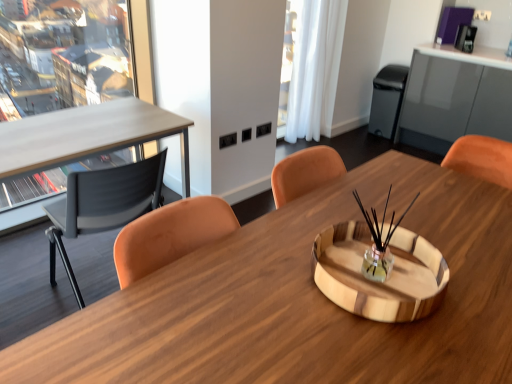
You are a GUI agent. You are given a task and a screenshot of the screen. Output one action in this format:
    pyautogui.click(x=<x>, y=<y>)
    Task: Click on the white sheer curtain at upper right
    The height and width of the screenshot is (384, 512).
    Given the screenshot: What is the action you would take?
    [x=315, y=69]

Image resolution: width=512 pixels, height=384 pixels. Describe the element at coordinates (387, 100) in the screenshot. I see `black matte trash bin/can at right` at that location.

In order to click on white sheer curtain at upper right in this screenshot , I will do pyautogui.click(x=315, y=69).

Is wooden desk at center placed right next to white sheer curtain at upper right?

No, wooden desk at center is not next to white sheer curtain at upper right.

Between wooden desk at center and white sheer curtain at upper right, which one has larger size?

Bigger between the two is wooden desk at center.

From the image's perspective, does wooden desk at center appear lower than white sheer curtain at upper right?

Yes, from the image's perspective, wooden desk at center is beneath white sheer curtain at upper right.

Is point (146, 282) in front of point (320, 122)?

That is True.

Can you confirm if wooden desk at center is thinner than black matte trash bin/can at right?

No.

Find the location of a particular element. The height and width of the screenshot is (384, 512). desk that is below the black matte trash bin/can at right (from the image's perspective) is located at coordinates tap(300, 300).

From the image's perspective, between wooden desk at center and black matte trash bin/can at right, who is located below?

wooden desk at center, from the image's perspective.

Considering the relative positions of matte black chair at left and black matte trash bin/can at right in the image provided, is matte black chair at left in front of black matte trash bin/can at right?

Yes, it is.

Which object is positioned more to the left, matte black chair at left or black matte trash bin/can at right?

matte black chair at left.

Where is `trash bin/can below the matte black chair at left (from a real-world perspective)`? trash bin/can below the matte black chair at left (from a real-world perspective) is located at coordinates (387, 100).

From a real-world perspective, which is physically below, white sheer curtain at upper right or matte black chair at left?

In real-world perspective, matte black chair at left is lower.

Looking at the image, does white sheer curtain at upper right seem bigger or smaller compared to matte black chair at left?

Considering their sizes, white sheer curtain at upper right takes up less space than matte black chair at left.

Which of these two, white sheer curtain at upper right or matte black chair at left, is wider?

matte black chair at left is wider.

Which of these two, white sheer curtain at upper right or matte black chair at left, stands shorter?

Standing shorter between the two is matte black chair at left.

Who is shorter, black matte trash bin/can at right or matte black chair at left?

With less height is black matte trash bin/can at right.

Looking at their sizes, would you say black matte trash bin/can at right is wider or thinner than matte black chair at left?

black matte trash bin/can at right is thinner than matte black chair at left.

Can you confirm if black matte trash bin/can at right is positioned to the left of matte black chair at left?

In fact, black matte trash bin/can at right is to the right of matte black chair at left.

Would you say black matte trash bin/can at right is to the left or to the right of wooden desk at center in the picture?

In the image, black matte trash bin/can at right appears on the right side of wooden desk at center.

From the image's perspective, which is below, black matte trash bin/can at right or wooden desk at center?

wooden desk at center appears lower in the image.

Is black matte trash bin/can at right facing towards wooden desk at center?

No.

Which is in front, point (386, 74) or point (404, 161)?

The point (404, 161) is closer.

Which object is further away from the camera, matte black chair at left or wooden desk at center?

matte black chair at left is more distant.

Is wooden desk at center at the back of matte black chair at left?

That's right, matte black chair at left is facing away from wooden desk at center.

How different are the orientations of matte black chair at left and wooden desk at center in degrees?

The angular difference between matte black chair at left and wooden desk at center is 166 degrees.

From a real-world perspective, is matte black chair at left over wooden desk at center?

Yes, from a real-world perspective, matte black chair at left is on top of wooden desk at center.

Image resolution: width=512 pixels, height=384 pixels. There is a wooden desk at center. Find the location of `curtain above it (from a real-world perspective)`. curtain above it (from a real-world perspective) is located at coordinates (315, 69).

The height and width of the screenshot is (384, 512). I want to click on desk on the left of black matte trash bin/can at right, so click(300, 300).

Which object lies further to the anchor point wooden desk at center, black matte trash bin/can at right or white sheer curtain at upper right?

Based on the image, black matte trash bin/can at right appears to be further to wooden desk at center.

Looking at the image, which one is located further to white sheer curtain at upper right, wooden desk at center or matte black chair at left?

wooden desk at center.

Considering their positions, is wooden desk at center positioned further to matte black chair at left than white sheer curtain at upper right?

Among the two, white sheer curtain at upper right is located further to matte black chair at left.

From the image, which object appears to be nearer to white sheer curtain at upper right, black matte trash bin/can at right or matte black chair at left?

black matte trash bin/can at right is positioned closer to the anchor white sheer curtain at upper right.

Which object lies further to the anchor point black matte trash bin/can at right, wooden desk at center or matte black chair at left?

matte black chair at left lies further to black matte trash bin/can at right than the other object.

Considering their positions, is wooden desk at center positioned closer to white sheer curtain at upper right than black matte trash bin/can at right?

black matte trash bin/can at right is closer to white sheer curtain at upper right.

Looking at the image, which one is located closer to black matte trash bin/can at right, wooden desk at center or white sheer curtain at upper right?

The object closer to black matte trash bin/can at right is white sheer curtain at upper right.

Consider the image. Estimate the real-world distances between objects in this image. Which object is further from black matte trash bin/can at right, matte black chair at left or white sheer curtain at upper right?

The object further to black matte trash bin/can at right is matte black chair at left.

Where is `curtain between matte black chair at left and black matte trash bin/can at right from front to back`? curtain between matte black chair at left and black matte trash bin/can at right from front to back is located at coordinates (315, 69).

The height and width of the screenshot is (384, 512). Identify the location of chair between wooden desk at center and black matte trash bin/can at right in the front-back direction. (103, 205).

Find the location of a particular element. Image resolution: width=512 pixels, height=384 pixels. chair between wooden desk at center and white sheer curtain at upper right from front to back is located at coordinates point(103,205).

You are a GUI agent. You are given a task and a screenshot of the screen. Output one action in this format:
    pyautogui.click(x=<x>, y=<y>)
    Task: Click on the curtain located between wooden desk at center and black matte trash bin/can at right in the depth direction
    The image size is (512, 384).
    Given the screenshot: What is the action you would take?
    pyautogui.click(x=315, y=69)